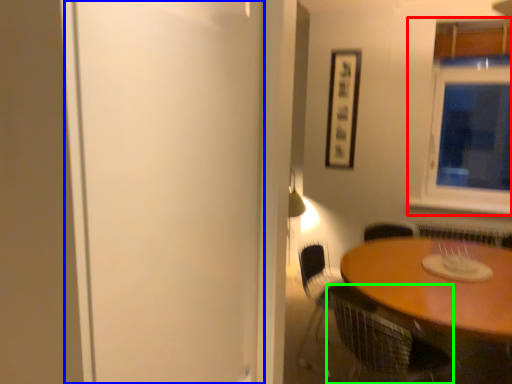
Question: Which object is the farthest from window (highlighted by a red box)? Choose among these: screen door (highlighted by a blue box) or chair (highlighted by a green box).

Choices:
 (A) screen door
 (B) chair

Answer: (A)